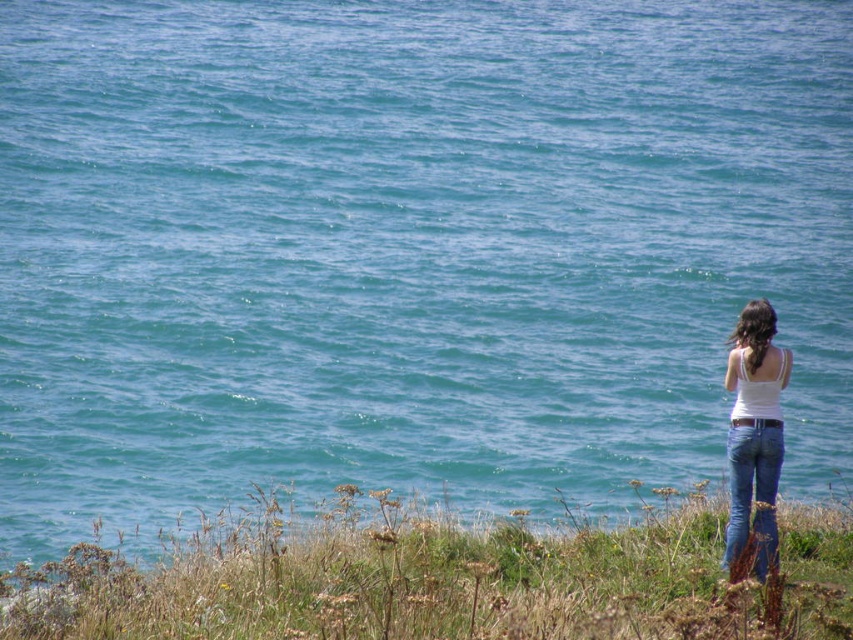
Is white cotton tank top at right positioned in front of blue denim jeans at lower right?

No, white cotton tank top at right is further to the viewer.

Find the location of a particular element. This screenshot has height=640, width=853. white cotton tank top at right is located at coordinates (753, 432).

Identify the location of white cotton tank top at right. (753, 432).